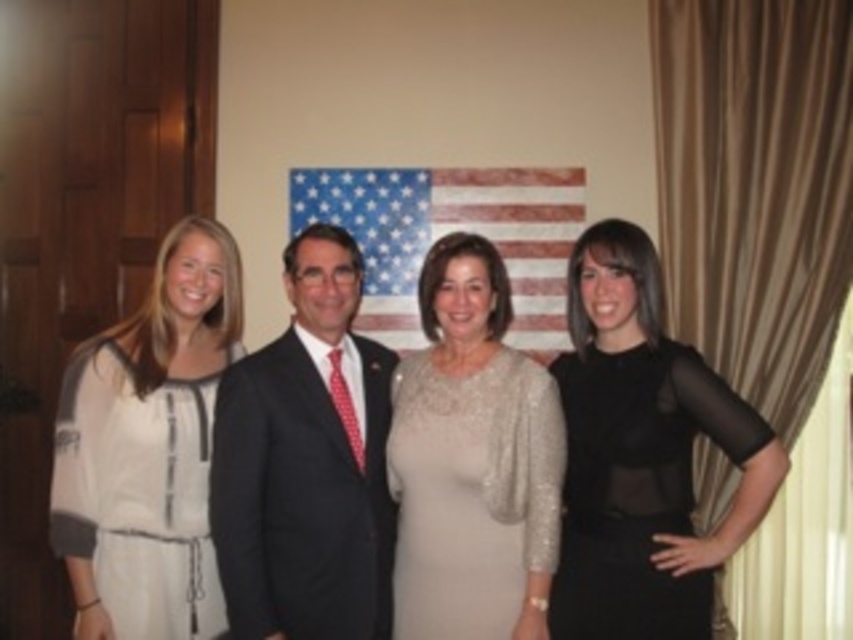
Question: Can you confirm if white sheer dress at left is bigger than sequined beige dress at center?

Choices:
 (A) yes
 (B) no

Answer: (A)

Question: Which is nearer to the dark suit at center?

Choices:
 (A) american flag at center
 (B) sequined beige dress at center
 (C) white sheer dress at left

Answer: (B)

Question: Is black sheer dress at right to the right of dark suit at center from the viewer's perspective?

Choices:
 (A) yes
 (B) no

Answer: (A)

Question: Which object is farther from the camera taking this photo?

Choices:
 (A) american flag at center
 (B) sequined beige dress at center
 (C) matte white dress at center
 (D) dark suit at center

Answer: (A)

Question: Which object appears closest to the camera in this image?

Choices:
 (A) dark suit at center
 (B) white sheer dress at left
 (C) black sheer dress at right
 (D) sequined beige dress at center

Answer: (C)

Question: Does white sheer dress at left have a greater width compared to american flag at center?

Choices:
 (A) no
 (B) yes

Answer: (A)